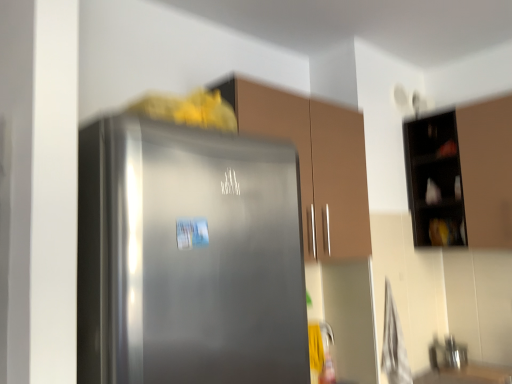
Question: Which direction should I rotate to look at matte brown cabinet at center, the second cabinetry when ordered from right to left, — up or down?

Choices:
 (A) up
 (B) down

Answer: (A)

Question: From a real-world perspective, is matte brown cabinet at center, the first cabinetry positioned from the left, beneath smooth wooden counter top at lower right?

Choices:
 (A) no
 (B) yes

Answer: (A)

Question: Is matte brown cabinet at center, the second cabinetry when ordered from right to left, at the right side of smooth wooden counter top at lower right?

Choices:
 (A) yes
 (B) no

Answer: (B)

Question: Are matte brown cabinet at center, the first cabinetry positioned from the left, and smooth wooden counter top at lower right far apart?

Choices:
 (A) no
 (B) yes

Answer: (B)

Question: Considering the relative sizes of matte brown cabinet at center, the second cabinetry when ordered from right to left, and smooth wooden counter top at lower right in the image provided, is matte brown cabinet at center, the second cabinetry when ordered from right to left, smaller than smooth wooden counter top at lower right?

Choices:
 (A) yes
 (B) no

Answer: (B)

Question: Does matte brown cabinet at center, the first cabinetry positioned from the left, have a lesser height compared to smooth wooden counter top at lower right?

Choices:
 (A) no
 (B) yes

Answer: (A)

Question: Considering the relative sizes of matte brown cabinet at center, the first cabinetry positioned from the left, and smooth wooden counter top at lower right in the image provided, is matte brown cabinet at center, the first cabinetry positioned from the left, bigger than smooth wooden counter top at lower right?

Choices:
 (A) yes
 (B) no

Answer: (A)

Question: Is metallic stainless steel sink at lower right located outside satin silver refrigerator at center?

Choices:
 (A) no
 (B) yes

Answer: (B)

Question: Are metallic stainless steel sink at lower right and satin silver refrigerator at center beside each other?

Choices:
 (A) yes
 (B) no

Answer: (B)

Question: Is satin silver refrigerator at center a part of metallic stainless steel sink at lower right?

Choices:
 (A) yes
 (B) no

Answer: (B)

Question: Can you confirm if metallic stainless steel sink at lower right is taller than satin silver refrigerator at center?

Choices:
 (A) yes
 (B) no

Answer: (B)

Question: From the image's perspective, is metallic stainless steel sink at lower right below satin silver refrigerator at center?

Choices:
 (A) no
 (B) yes

Answer: (B)

Question: Considering the relative sizes of metallic stainless steel sink at lower right and satin silver refrigerator at center in the image provided, is metallic stainless steel sink at lower right wider than satin silver refrigerator at center?

Choices:
 (A) no
 (B) yes

Answer: (A)

Question: Considering the relative sizes of smooth wooden counter top at lower right and metallic stainless steel sink at lower right in the image provided, is smooth wooden counter top at lower right smaller than metallic stainless steel sink at lower right?

Choices:
 (A) yes
 (B) no

Answer: (A)